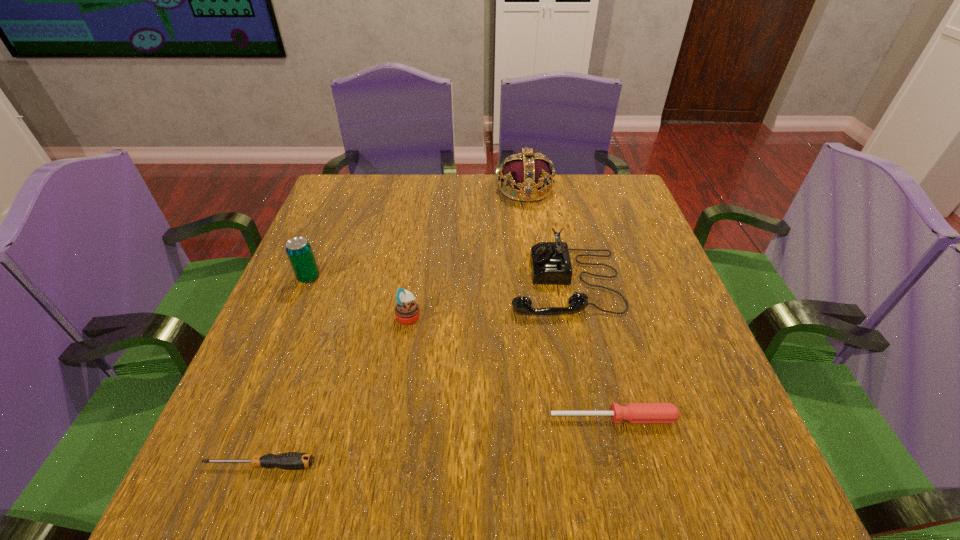
Choose which object is the nearest neighbor to the beer can. Please provide its 2D coordinates. Your answer should be formatted as a tuple, i.e. [(x, y)], where the tuple contains the x and y coordinates of a point satisfying the conditions above.

[(407, 312)]